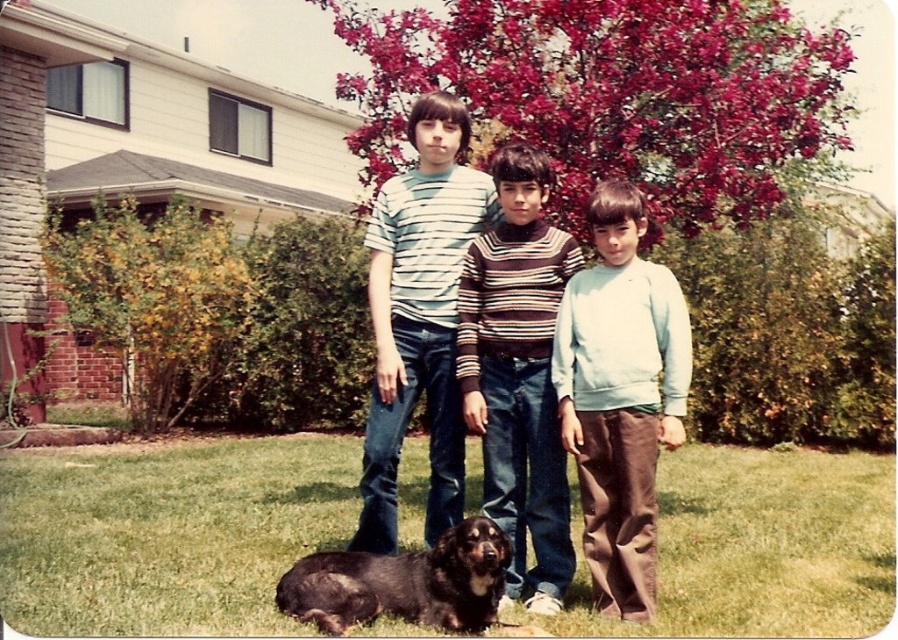
From the picture: Does green grass at lower center have a lesser height compared to light blue sweater at center?

Yes.

Does point (879, 556) come closer to viewer compared to point (659, 320)?

No, it is behind (659, 320).

Who is more distant from viewer, (703, 516) or (580, 401)?

Point (703, 516)

Locate an element on the screen. green grass at lower center is located at coordinates (166, 532).

Can you confirm if green grass at lower center is thinner than black shaggy dog at lower center?

No, green grass at lower center is not thinner than black shaggy dog at lower center.

Which is in front, point (582, 564) or point (315, 596)?

Positioned in front is point (315, 596).

Between point (207, 529) and point (320, 580), which one is positioned behind?

Point (207, 529)

Image resolution: width=898 pixels, height=640 pixels. I want to click on green grass at lower center, so click(166, 532).

Between point (113, 552) and point (425, 129), which one is positioned in front?

Point (425, 129) is more forward.

Does green grass at lower center have a larger size compared to striped cotton shirt at center?

Correct, green grass at lower center is larger in size than striped cotton shirt at center.

Does point (219, 516) come closer to viewer compared to point (443, 429)?

No, it is not.

At what (x,y) coordinates should I click in order to perform the action: click on green grass at lower center. Please return your answer as a coordinate pair (x, y). The height and width of the screenshot is (640, 898). Looking at the image, I should click on (166, 532).